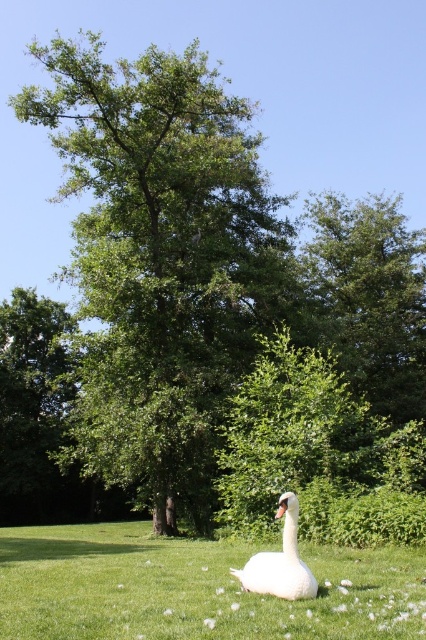
Is green leafy tree at center below white glossy swan at center?

No.

Which is in front, point (207, 74) or point (293, 548)?

Point (293, 548) is more forward.

Does point (213, 442) come closer to viewer compared to point (285, 592)?

No.

Locate an element on the screen. This screenshot has width=426, height=640. green leafy tree at center is located at coordinates (155, 269).

Image resolution: width=426 pixels, height=640 pixels. What do you see at coordinates (155, 269) in the screenshot? I see `green leafy tree at center` at bounding box center [155, 269].

Does green leafy tree at center have a smaller size compared to white feathered swan at center?

No.

Does point (115, 477) lie in front of point (115, 564)?

No, it is not.

Find the location of a particular element. green leafy tree at center is located at coordinates (155, 269).

Is point (98, 600) farther from viewer compared to point (293, 557)?

No, it is not.

Is point (100, 529) in front of point (307, 595)?

No, (100, 529) is behind (307, 595).

At what (x,y) coordinates should I click in order to perform the action: click on white feathered swan at center. Please return your answer as a coordinate pair (x, y). The width and height of the screenshot is (426, 640). Looking at the image, I should click on (195, 588).

Find the location of a particular element. The image size is (426, 640). white feathered swan at center is located at coordinates (195, 588).